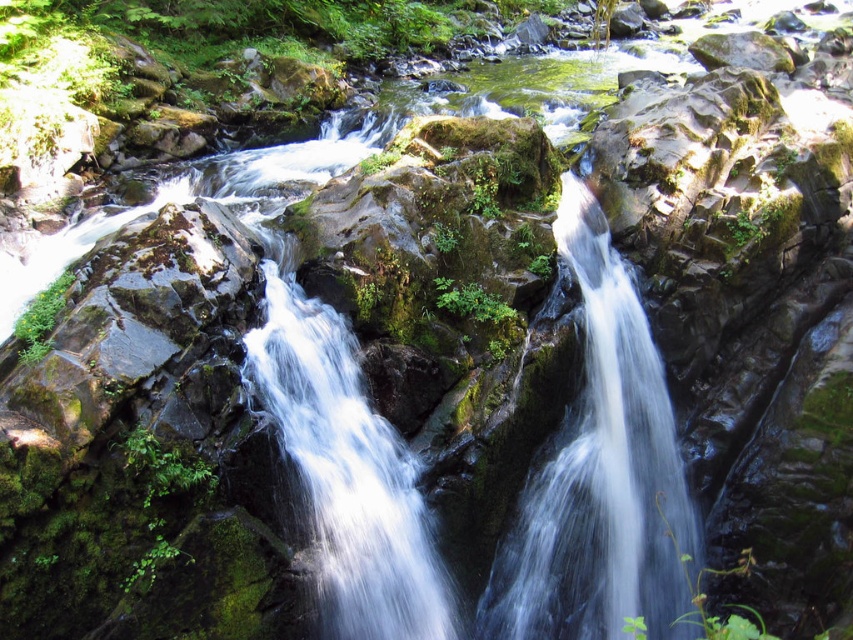
Question: Does translucent glass waterfall at center appear over clear water at center?

Choices:
 (A) yes
 (B) no

Answer: (A)

Question: Can you confirm if translucent glass waterfall at center is positioned above clear water at center?

Choices:
 (A) yes
 (B) no

Answer: (A)

Question: Which of the following is the farthest from the observer?

Choices:
 (A) (374, 428)
 (B) (610, 269)

Answer: (B)

Question: From the image, what is the correct spatial relationship of translucent glass waterfall at center in relation to clear water at center?

Choices:
 (A) below
 (B) above

Answer: (B)

Question: Which of the following is the closest to the observer?

Choices:
 (A) clear water at center
 (B) translucent glass waterfall at center

Answer: (A)